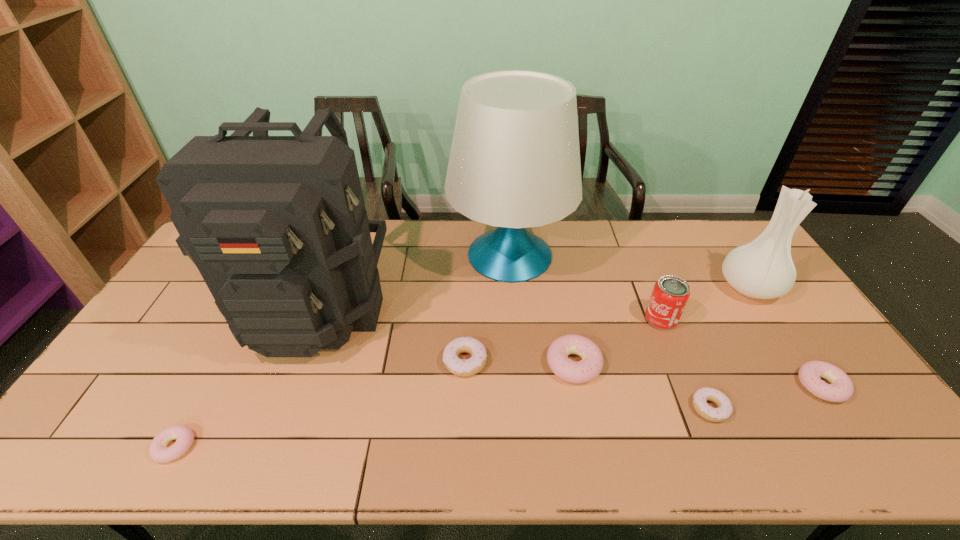
Image resolution: width=960 pixels, height=540 pixels. Identify the location of table lamp. (514, 163).

Where is `gray backpack`? This screenshot has height=540, width=960. gray backpack is located at coordinates (276, 225).

Find the location of a particular element. white vase is located at coordinates (763, 269).

Where is `the seventh shortest object`? The image size is (960, 540). the seventh shortest object is located at coordinates (763, 269).

You are a GUI agent. You are given a task and a screenshot of the screen. Output one action in this format:
    pyautogui.click(x=<x>, y=<y>)
    Task: Click on the fourth tallest object
    The height and width of the screenshot is (540, 960).
    Given the screenshot: What is the action you would take?
    pyautogui.click(x=670, y=294)

Where is `red can`? This screenshot has width=960, height=540. red can is located at coordinates (670, 294).

What are the coordinates of `the biggest pink doughnut` in the screenshot? It's located at (590, 366).

At what (x,y) coordinates should I click in order to perform the action: click on the third doughnut from left to right. Please return your answer as a coordinate pair (x, y). Image resolution: width=960 pixels, height=540 pixels. Looking at the image, I should click on (590, 366).

The width and height of the screenshot is (960, 540). I want to click on the bigger white doughnut, so click(473, 365).

Identify the location of the farther white doughnut. Image resolution: width=960 pixels, height=540 pixels. tap(473, 365).